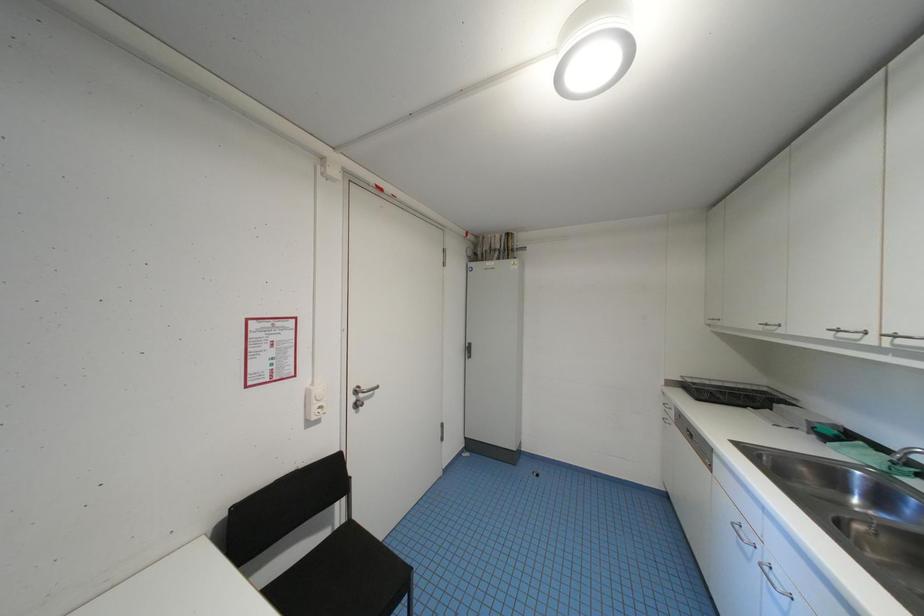
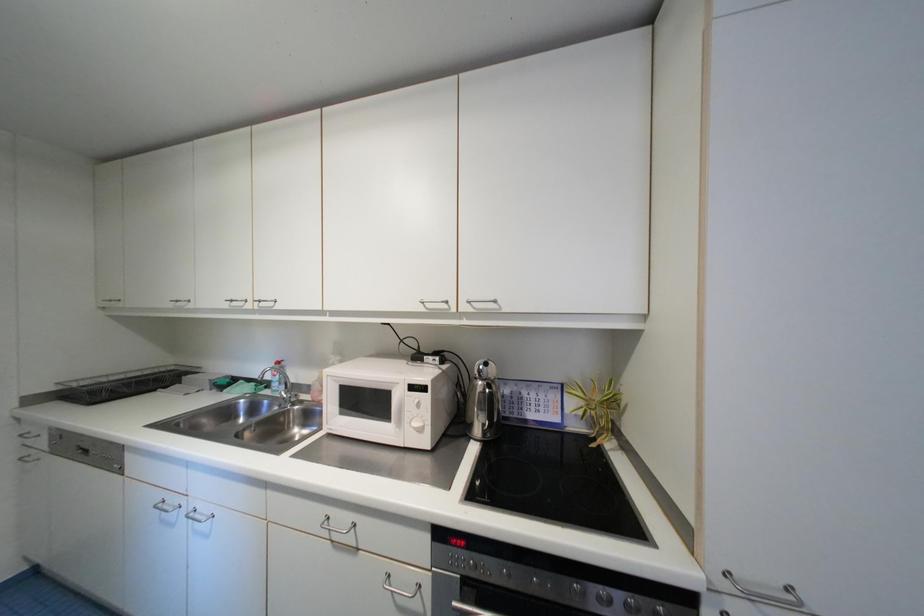
Question: The first image is from the beginning of the video and the second image is from the end. How did the camera likely rotate when shooting the video?

Choices:
 (A) Left
 (B) Right
 (C) Up
 (D) Down

Answer: (B)